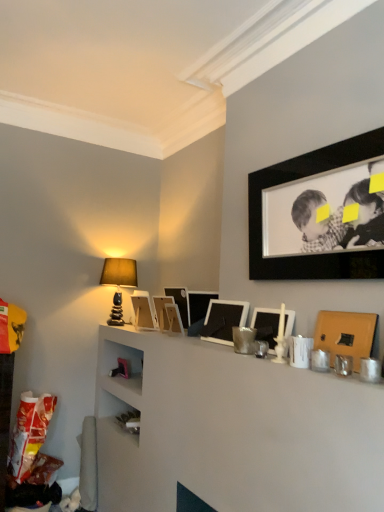
In order to face matte black picture frame at center, the fourth picture frame positioned from the front, should I rotate leftwards or rightwards?

A 4.077 degree turn to the right will do.

Measure the distance between matte white picture frame at upper center, acting as the 8th picture frame starting from the front, and camera.

matte white picture frame at upper center, acting as the 8th picture frame starting from the front, and camera are 3.13 meters apart.

In the scene shown: How much space does matte white picture frame at upper center, the first picture frame from the back, occupy vertically?

matte white picture frame at upper center, the first picture frame from the back, is 27.82 centimeters tall.

The height and width of the screenshot is (512, 384). In order to click on wooden picture frame at center, positioned as the sixth picture frame in front-to-back order in this screenshot , I will do (x=174, y=319).

Identify the location of matte black picture frame at center, which is the 5th picture frame in front-to-back order. The image size is (384, 512). (198, 304).

At what (x,y) coordinates should I click in order to perform the action: click on wooden picture frame at center, arranged as the second picture frame when viewed from the back. Please return your answer as a coordinate pair (x, y). This screenshot has width=384, height=512. Looking at the image, I should click on (162, 311).

What is the approximate height of matte stone table lamp at upper left?

matte stone table lamp at upper left is 57.11 centimeters tall.

Consider the image. How much space does matte white picture frame at center, positioned as the sixth picture frame in back-to-front order, occupy horizontally?

The width of matte white picture frame at center, positioned as the sixth picture frame in back-to-front order, is 3.56 inches.

Locate an element on the screen. This screenshot has width=384, height=512. matte black picture frame at center, placed as the fifth picture frame when sorted from back to front is located at coordinates (223, 320).

Can you confirm if matte black picture frame at center, the fourth picture frame positioned from the front, is shorter than matte gold picture frame at right, the 7th picture frame in the back-to-front sequence?

No, matte black picture frame at center, the fourth picture frame positioned from the front, is not shorter than matte gold picture frame at right, the 7th picture frame in the back-to-front sequence.

Considering the positions of objects matte black picture frame at center, placed as the fifth picture frame when sorted from back to front, and matte gold picture frame at right, the 2th picture frame in the front-to-back sequence, in the image provided, who is more to the left, matte black picture frame at center, placed as the fifth picture frame when sorted from back to front, or matte gold picture frame at right, the 2th picture frame in the front-to-back sequence,?

matte black picture frame at center, placed as the fifth picture frame when sorted from back to front, is more to the left.

Are matte black picture frame at center, the fourth picture frame positioned from the front, and matte gold picture frame at right, the 2th picture frame in the front-to-back sequence, located far from each other?

No.

Which object is closer to the camera, matte black picture frame at center, placed as the fifth picture frame when sorted from back to front, or matte gold picture frame at right, the 2th picture frame in the front-to-back sequence?

Positioned in front is matte gold picture frame at right, the 2th picture frame in the front-to-back sequence.

Can you tell me how much wooden picture frame at center, placed as the 7th picture frame when sorted from front to back, and matte black picture frame at center, which appears as the fourth picture frame when viewed from the back, differ in facing direction?

wooden picture frame at center, placed as the 7th picture frame when sorted from front to back, and matte black picture frame at center, which appears as the fourth picture frame when viewed from the back, are facing 24.9 degrees away from each other.

Considering the sizes of wooden picture frame at center, arranged as the second picture frame when viewed from the back, and matte black picture frame at center, which is the 5th picture frame in front-to-back order, in the image, is wooden picture frame at center, arranged as the second picture frame when viewed from the back, bigger or smaller than matte black picture frame at center, which is the 5th picture frame in front-to-back order,?

In the image, wooden picture frame at center, arranged as the second picture frame when viewed from the back, appears to be larger than matte black picture frame at center, which is the 5th picture frame in front-to-back order.

In the image, is wooden picture frame at center, arranged as the second picture frame when viewed from the back, on the left side or the right side of matte black picture frame at center, which is the 5th picture frame in front-to-back order?

wooden picture frame at center, arranged as the second picture frame when viewed from the back, is positioned on matte black picture frame at center, which is the 5th picture frame in front-to-back order,'s left side.

From a real-world perspective, does wooden picture frame at center, arranged as the second picture frame when viewed from the back, stand above matte black picture frame at center, which appears as the fourth picture frame when viewed from the back?

No, from a real-world perspective, wooden picture frame at center, arranged as the second picture frame when viewed from the back, is not on top of matte black picture frame at center, which appears as the fourth picture frame when viewed from the back.

From the image's perspective, relative to matte white picture frame at center, the third picture frame positioned from the front, is matte stone table lamp at upper left above or below?

Based on their image positions, matte stone table lamp at upper left is located above matte white picture frame at center, the third picture frame positioned from the front.

Based on the photo, is matte stone table lamp at upper left taller or shorter than matte white picture frame at center, positioned as the sixth picture frame in back-to-front order?

Considering their sizes, matte stone table lamp at upper left has more height than matte white picture frame at center, positioned as the sixth picture frame in back-to-front order.

Considering the relative positions of matte stone table lamp at upper left and matte white picture frame at center, positioned as the sixth picture frame in back-to-front order, in the image provided, is matte stone table lamp at upper left to the right of matte white picture frame at center, positioned as the sixth picture frame in back-to-front order, from the viewer's perspective?

No, matte stone table lamp at upper left is not to the right of matte white picture frame at center, positioned as the sixth picture frame in back-to-front order.

Can you see matte stone table lamp at upper left touching matte white picture frame at center, positioned as the sixth picture frame in back-to-front order?

There is a gap between matte stone table lamp at upper left and matte white picture frame at center, positioned as the sixth picture frame in back-to-front order.

From the image's perspective, is matte white picture frame at center, the third picture frame positioned from the front, below wooden picture frame at center, positioned as the 3th picture frame in back-to-front order?

No, from the image's perspective, matte white picture frame at center, the third picture frame positioned from the front, is not below wooden picture frame at center, positioned as the 3th picture frame in back-to-front order.

Is matte white picture frame at center, the third picture frame positioned from the front, at the right side of wooden picture frame at center, positioned as the 3th picture frame in back-to-front order?

Yes.

Is matte white picture frame at center, the third picture frame positioned from the front, thinner than wooden picture frame at center, positioned as the sixth picture frame in front-to-back order?

Yes.

You are a GUI agent. You are given a task and a screenshot of the screen. Output one action in this format:
    pyautogui.click(x=<x>, y=<y>)
    Task: Click on the table lamp behind the wooden picture frame at center, positioned as the sixth picture frame in front-to-back order
    The image size is (384, 512).
    Given the screenshot: What is the action you would take?
    pyautogui.click(x=118, y=283)

Is point (123, 278) less distant than point (172, 332)?

No, it is not.

From a real-world perspective, which is physically below, matte stone table lamp at upper left or wooden picture frame at center, positioned as the 3th picture frame in back-to-front order?

In real-world perspective, wooden picture frame at center, positioned as the 3th picture frame in back-to-front order, is lower.

In terms of height, does matte stone table lamp at upper left look taller or shorter compared to wooden picture frame at center, positioned as the 3th picture frame in back-to-front order?

Considering their sizes, matte stone table lamp at upper left has more height than wooden picture frame at center, positioned as the 3th picture frame in back-to-front order.

Is matte white picture frame at upper center, the first picture frame from the back, surrounding black matte picture frame at upper right, arranged as the eighth picture frame when viewed from the back?

Actually, black matte picture frame at upper right, arranged as the eighth picture frame when viewed from the back, is outside matte white picture frame at upper center, the first picture frame from the back.

Is matte white picture frame at upper center, the first picture frame from the back, to the left of black matte picture frame at upper right, which ranks as the first picture frame in front-to-back order, from the viewer's perspective?

Yes.

Which is behind, point (140, 295) or point (253, 192)?

The point (140, 295) is farther from the camera.

Relative to black matte picture frame at upper right, arranged as the eighth picture frame when viewed from the back, is matte white picture frame at upper center, the first picture frame from the back, in front or behind?

In the image, matte white picture frame at upper center, the first picture frame from the back, appears behind black matte picture frame at upper right, arranged as the eighth picture frame when viewed from the back.

Considering the sizes of black matte picture frame at upper right, which ranks as the first picture frame in front-to-back order, and matte black picture frame at center, the fourth picture frame positioned from the front, in the image, is black matte picture frame at upper right, which ranks as the first picture frame in front-to-back order, wider or thinner than matte black picture frame at center, the fourth picture frame positioned from the front,?

Clearly, black matte picture frame at upper right, which ranks as the first picture frame in front-to-back order, has less width compared to matte black picture frame at center, the fourth picture frame positioned from the front.

Is black matte picture frame at upper right, arranged as the eighth picture frame when viewed from the back, facing away from matte black picture frame at center, the fourth picture frame positioned from the front?

No, matte black picture frame at center, the fourth picture frame positioned from the front, is not at the back of black matte picture frame at upper right, arranged as the eighth picture frame when viewed from the back.

From a real-world perspective, who is located lower, black matte picture frame at upper right, which ranks as the first picture frame in front-to-back order, or matte black picture frame at center, placed as the fifth picture frame when sorted from back to front?

From a 3D spatial view, matte black picture frame at center, placed as the fifth picture frame when sorted from back to front, is below.

How far apart are black matte picture frame at upper right, which ranks as the first picture frame in front-to-back order, and matte black picture frame at center, placed as the fifth picture frame when sorted from back to front?

black matte picture frame at upper right, which ranks as the first picture frame in front-to-back order, is 20.46 inches away from matte black picture frame at center, placed as the fifth picture frame when sorted from back to front.

This screenshot has height=512, width=384. I want to click on picture frame that is the 3rd object to the right of the matte black picture frame at center, the fourth picture frame positioned from the front, starting at the anchor, so click(x=345, y=334).

The height and width of the screenshot is (512, 384). I want to click on the 1st picture frame positioned below the matte black picture frame at center, which appears as the fourth picture frame when viewed from the back (from a real-world perspective), so click(x=162, y=311).

Which object lies nearer to the anchor point matte stone table lamp at upper left, matte black picture frame at center, which appears as the fourth picture frame when viewed from the back, or matte white picture frame at center, positioned as the sixth picture frame in back-to-front order?

matte black picture frame at center, which appears as the fourth picture frame when viewed from the back.

Based on their spatial positions, is wooden picture frame at center, placed as the 7th picture frame when sorted from front to back, or matte gold picture frame at right, the 7th picture frame in the back-to-front sequence, closer to wooden picture frame at center, positioned as the sixth picture frame in front-to-back order?

wooden picture frame at center, placed as the 7th picture frame when sorted from front to back, is closer to wooden picture frame at center, positioned as the sixth picture frame in front-to-back order.

Considering their positions, is matte black picture frame at center, which is the 5th picture frame in front-to-back order, positioned closer to matte gold picture frame at right, the 7th picture frame in the back-to-front sequence, than matte black picture frame at center, the fourth picture frame positioned from the front?

Among the two, matte black picture frame at center, the fourth picture frame positioned from the front, is located nearer to matte gold picture frame at right, the 7th picture frame in the back-to-front sequence.

Estimate the real-world distances between objects in this image. Which object is closer to matte black picture frame at center, which appears as the fourth picture frame when viewed from the back, black matte picture frame at upper right, arranged as the eighth picture frame when viewed from the back, or matte gold picture frame at right, the 7th picture frame in the back-to-front sequence?

black matte picture frame at upper right, arranged as the eighth picture frame when viewed from the back, is closer to matte black picture frame at center, which appears as the fourth picture frame when viewed from the back.

Based on their spatial positions, is matte stone table lamp at upper left or black matte picture frame at upper right, arranged as the eighth picture frame when viewed from the back, further from matte white picture frame at center, positioned as the sixth picture frame in back-to-front order?

matte stone table lamp at upper left lies further to matte white picture frame at center, positioned as the sixth picture frame in back-to-front order, than the other object.

When comparing their distances from matte gold picture frame at right, the 7th picture frame in the back-to-front sequence, does matte white picture frame at center, positioned as the sixth picture frame in back-to-front order, or matte black picture frame at center, the fourth picture frame positioned from the front, seem further?

matte black picture frame at center, the fourth picture frame positioned from the front, is further to matte gold picture frame at right, the 7th picture frame in the back-to-front sequence.

In the scene shown: Looking at the image, which one is located further to wooden picture frame at center, positioned as the sixth picture frame in front-to-back order, matte gold picture frame at right, the 7th picture frame in the back-to-front sequence, or black matte picture frame at upper right, arranged as the eighth picture frame when viewed from the back?

matte gold picture frame at right, the 7th picture frame in the back-to-front sequence.

Based on their spatial positions, is matte gold picture frame at right, the 7th picture frame in the back-to-front sequence, or matte black picture frame at center, the fourth picture frame positioned from the front, further from matte black picture frame at center, which appears as the fourth picture frame when viewed from the back?

matte gold picture frame at right, the 7th picture frame in the back-to-front sequence, is further to matte black picture frame at center, which appears as the fourth picture frame when viewed from the back.

I want to click on picture frame between wooden picture frame at center, positioned as the sixth picture frame in front-to-back order, and matte white picture frame at upper center, acting as the 8th picture frame starting from the front, from front to back, so (162, 311).

This screenshot has width=384, height=512. I want to click on picture frame between black matte picture frame at upper right, which ranks as the first picture frame in front-to-back order, and matte white picture frame at center, the third picture frame positioned from the front, vertically, so click(x=345, y=334).

Locate an element on the screen. This screenshot has height=512, width=384. picture frame situated between wooden picture frame at center, arranged as the second picture frame when viewed from the back, and matte black picture frame at center, which is the 5th picture frame in front-to-back order, from left to right is located at coordinates (174, 319).

This screenshot has height=512, width=384. Find the location of `picture frame between matte black picture frame at center, placed as the fifth picture frame when sorted from back to front, and wooden picture frame at center, positioned as the 3th picture frame in back-to-front order, in the front-back direction`. picture frame between matte black picture frame at center, placed as the fifth picture frame when sorted from back to front, and wooden picture frame at center, positioned as the 3th picture frame in back-to-front order, in the front-back direction is located at coordinates (198, 304).